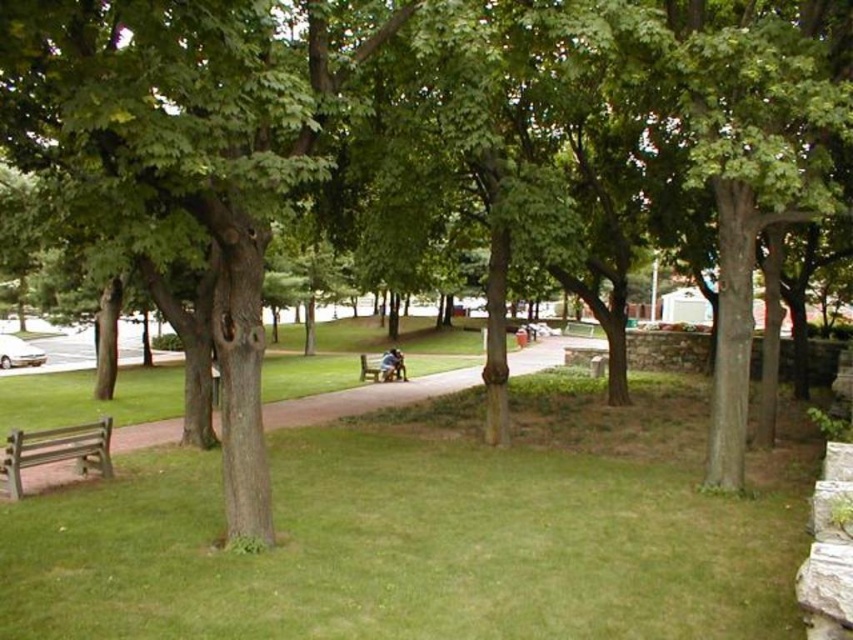
You are a park visitor who wants to find a bench to sit and enjoy the view. You see the brown wooden bench at lower left and the wooden park bench at center. Which bench is positioned higher up in the image?

The brown wooden bench at lower left is positioned higher up in the image because it is above the wooden park bench at center.

You are standing at the entrance of the park and see both the wooden bench at lower left and the wooden park bench at center. Which bench is closer to you?

The wooden bench at lower left is closer to you because it is positioned in front of the wooden park bench at center, meaning it is nearer to your viewpoint.